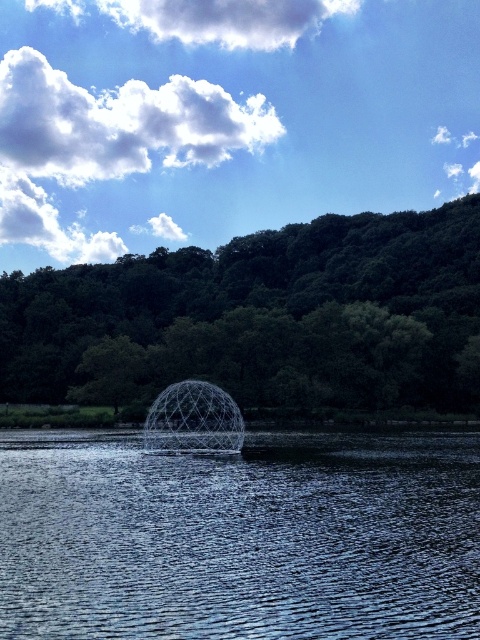
Is point (273, 454) behind point (464, 260)?

No, it is not.

Identify the location of glistening blue water at center. This screenshot has width=480, height=640. (240, 538).

Image resolution: width=480 pixels, height=640 pixels. Find the location of `glistening blue water at center`. glistening blue water at center is located at coordinates (240, 538).